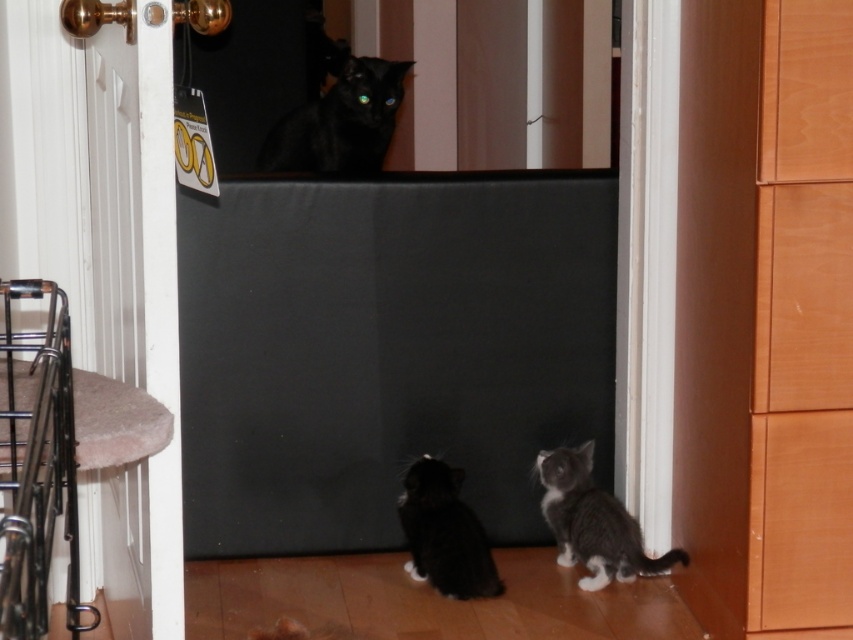
You are a cat owner who wants to ensure your two cats can play safely. The gray fluffy kitten at lower right and the soft fur cat at lower center are separated by a safety gate. Given that the distance between them is 66.47 centimeters, can the cats interact with each other through the gate?

The gray fluffy kitten at lower right and the soft fur cat at lower center are 66.47 centimeters apart. Since the safety gate separates them, they can see each other but cannot physically interact through the gate.

You are a cat owner who wants to ensure both cats can pass through the gate. Given that the gate has a 15 cm gap between bars, can both the black fur cat at lower center and the soft fur cat at lower center fit through the gate?

The black fur cat at lower center is bigger than the soft fur cat at lower center. If the black fur cat at lower center can fit through the 15 cm gap, then the smaller soft fur cat at lower center can also fit. However, if the black fur cat at lower center is too large for the gap, neither may fit. The answer depends on the actual size of the black fur cat at lower center relative to the 15 cm gap.

You are a cat owner who wants to ensure both cats can pass through a narrow opening in the gate. The opening is 30 cm wide. Given the black fur cat at lower center and the soft fur cat at lower center, which cat has a greater chance of fitting through the opening?

The black fur cat at lower center has a greater width than the soft fur cat at lower center. Therefore, the soft fur cat at lower center has a better chance of fitting through the 30 cm opening since it is narrower than the black fur cat at lower center.